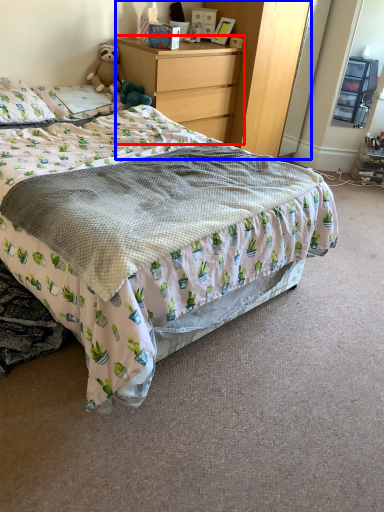
Question: Among these objects, which one is nearest to the camera, chest of drawers (highlighted by a red box) or dresser (highlighted by a blue box)?

Choices:
 (A) chest of drawers
 (B) dresser

Answer: (A)